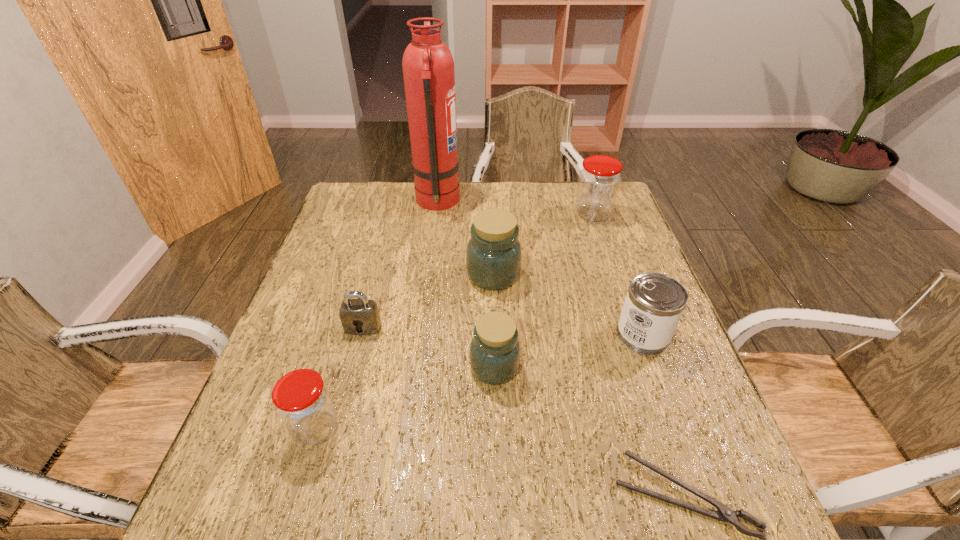
Locate an element on the screen. vacant region between the padlock and the tallest object is located at coordinates (400, 265).

Locate an element on the screen. free space between the can and the third object from left to right is located at coordinates (540, 268).

Find the location of `unoccupied position between the can and the right red jar`. unoccupied position between the can and the right red jar is located at coordinates (618, 274).

Select which object appears as the third closest to the third farthest object. Please provide its 2D coordinates. Your answer should be formatted as a tuple, i.e. [(x, y)], where the tuple contains the x and y coordinates of a point satisfying the conditions above.

[(360, 316)]

Select which object is the fourth closest to the bigger red jar. Please provide its 2D coordinates. Your answer should be formatted as a tuple, i.e. [(x, y)], where the tuple contains the x and y coordinates of a point satisfying the conditions above.

[(494, 354)]

Point out which jar is positioned as the second nearest to the bigger green jar. Please provide its 2D coordinates. Your answer should be formatted as a tuple, i.e. [(x, y)], where the tuple contains the x and y coordinates of a point satisfying the conditions above.

[(599, 180)]

Identify the location of the second closest jar relative to the second nearest jar. The height and width of the screenshot is (540, 960). (302, 400).

You are a GUI agent. You are given a task and a screenshot of the screen. Output one action in this format:
    pyautogui.click(x=<x>, y=<y>)
    Task: Click on the vacant area that satisfies the following two spatial constraints: 1. on the label side of the tallest object; 2. on the back side of the smaller green jar
    
    Given the screenshot: What is the action you would take?
    pyautogui.click(x=416, y=367)

Where is `blank area in the image that satisfies the following two spatial constraints: 1. on the label side of the third object from left to right; 2. at the front of the padlock near the keyhole`? blank area in the image that satisfies the following two spatial constraints: 1. on the label side of the third object from left to right; 2. at the front of the padlock near the keyhole is located at coordinates (420, 328).

Where is `free space that satisfies the following two spatial constraints: 1. on the label side of the third object from left to right; 2. on the right side of the right red jar`? The width and height of the screenshot is (960, 540). free space that satisfies the following two spatial constraints: 1. on the label side of the third object from left to right; 2. on the right side of the right red jar is located at coordinates (436, 214).